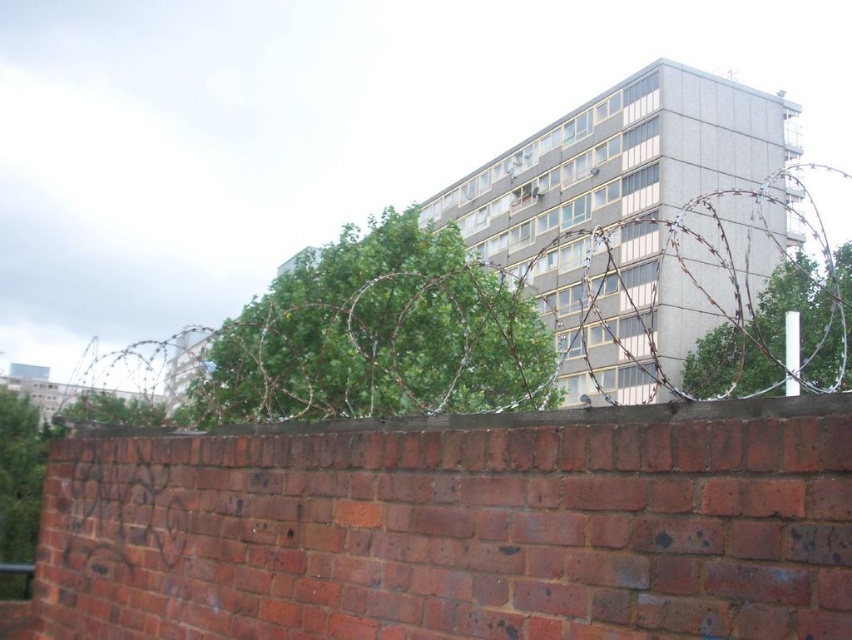
Is red brick wall at lower center to the right of barbed wire at upper center from the viewer's perspective?

No, red brick wall at lower center is not to the right of barbed wire at upper center.

Measure the distance between point (786, 483) and camera.

The distance of point (786, 483) from camera is 3.88 feet.

Who is more distant from viewer, (400, 628) or (125, 356)?

Point (125, 356)

Locate an element on the screen. This screenshot has height=640, width=852. red brick wall at lower center is located at coordinates (458, 528).